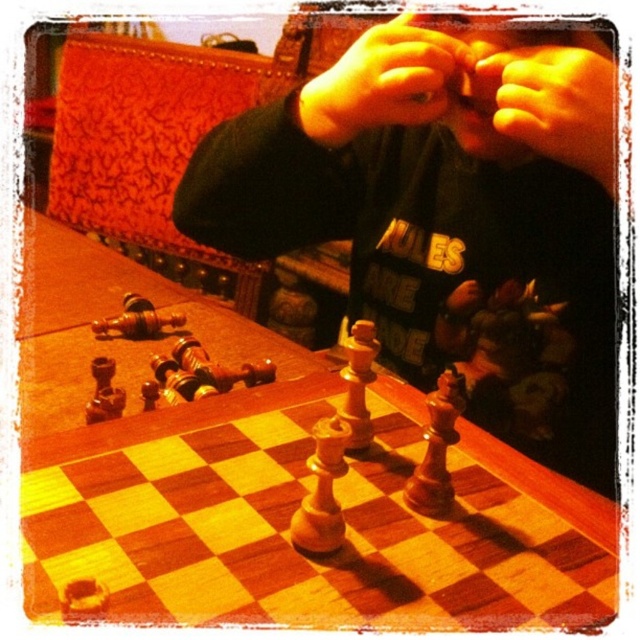
You are standing 1 meter away from the chessboard. Can you reach the point at coordinates point [369,566] on the chessboard if your arm can extend 1.2 meters?

The point [369,566] is 50.87 centimeters away from the viewer. Since your arm can extend 1.2 meters, which is longer than 50.87 centimeters, you can reach the point [369,566] on the chessboard.

You are a photographer trying to capture the chessboard setup without any hands obstructing the view. Based on the scene, which hand is closer to the camera between the smooth skin hand at upper center and the yellowish skin at center?

The yellowish skin at center is closer to the camera because the smooth skin hand at upper center is positioned under it.

You are a photographer aiming to capture the wooden chessboard at center and the smooth skin hand at upper center in your shot. Based on their positions, which object is closer to the left side of the frame?

The wooden chessboard at center is closer to the left side of the frame because it is positioned to the left of the smooth skin hand at upper center.